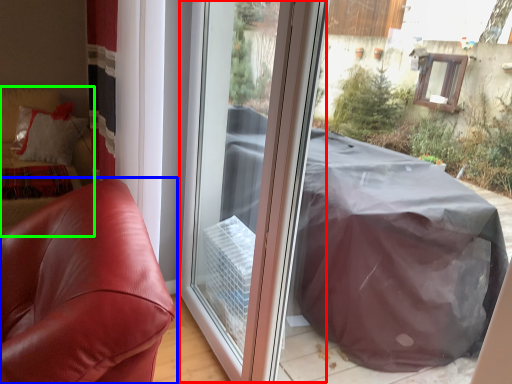
Question: Which object is the closest to the screen door (highlighted by a red box)? Choose among these: furniture (highlighted by a blue box) or couch (highlighted by a green box).

Choices:
 (A) furniture
 (B) couch

Answer: (A)